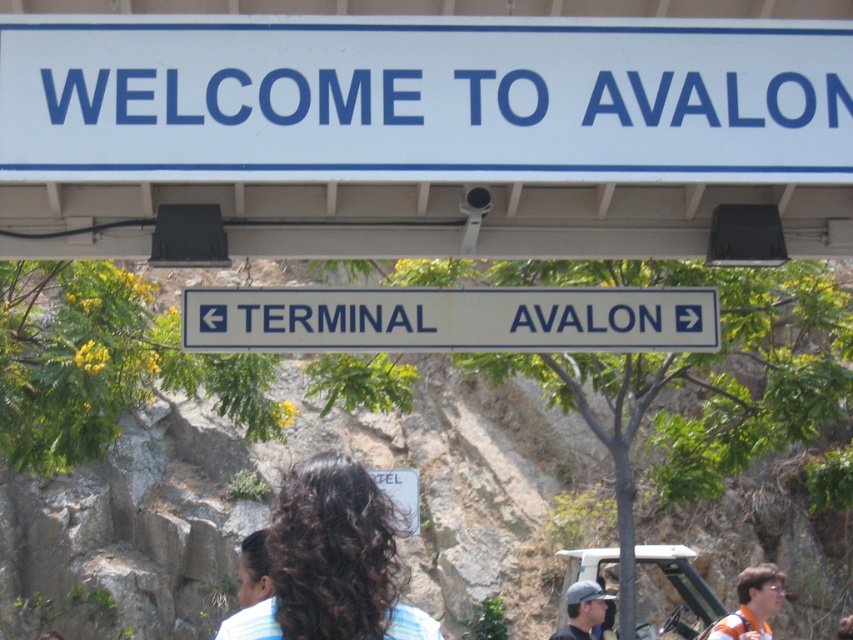
Question: Considering the relative positions of orange fabric shirt at lower right and matte gray cap at lower center in the image provided, where is orange fabric shirt at lower right located with respect to matte gray cap at lower center?

Choices:
 (A) above
 (B) below

Answer: (A)

Question: Which is farther from the dark brown curly hair at center?

Choices:
 (A) dark brown hair at center
 (B) matte gray cap at lower center
 (C) white plastic sign at center

Answer: (B)

Question: Which of the following is the closest to the observer?

Choices:
 (A) (x=567, y=628)
 (B) (x=444, y=38)
 (C) (x=339, y=477)
 (D) (x=189, y=305)

Answer: (C)

Question: Which point is farther to the camera?

Choices:
 (A) (587, 593)
 (B) (550, 320)
 (C) (244, 579)

Answer: (A)

Question: Is white plastic sign at upper center wider than dark brown curly hair at center?

Choices:
 (A) yes
 (B) no

Answer: (A)

Question: Is white plastic sign at center wider than dark brown curly hair at center?

Choices:
 (A) no
 (B) yes

Answer: (A)